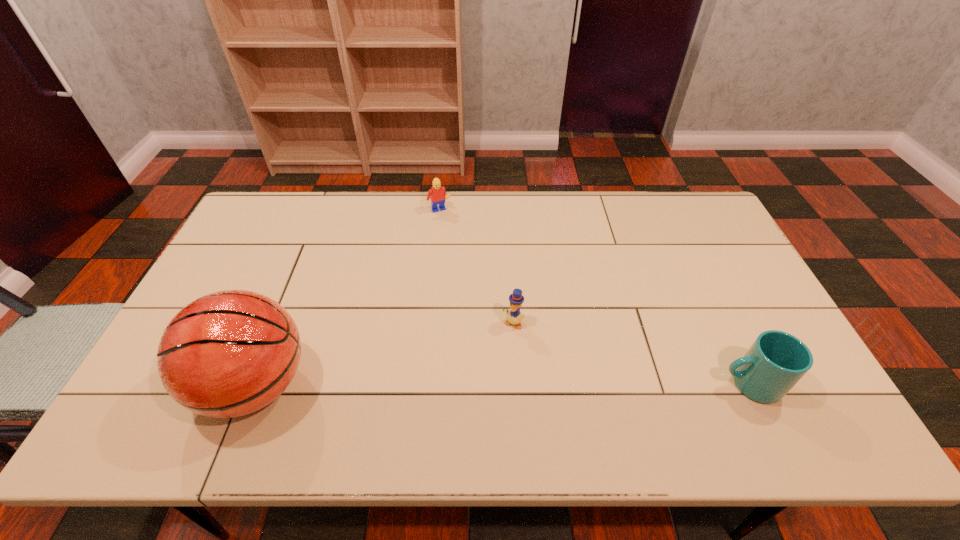
Identify the location of object that is at the right edge. (776, 361).

Where is `object at the near left corner`? The width and height of the screenshot is (960, 540). object at the near left corner is located at coordinates (230, 353).

You are a GUI agent. You are given a task and a screenshot of the screen. Output one action in this format:
    pyautogui.click(x=<x>, y=<y>)
    Task: Click on the object located at the near right corner
    This screenshot has width=960, height=540.
    Given the screenshot: What is the action you would take?
    pyautogui.click(x=776, y=361)

Image resolution: width=960 pixels, height=540 pixels. What are the coordinates of `vacant space at the far edge of the desktop` in the screenshot? It's located at (622, 207).

Locate an element on the screen. vacant space at the near edge of the desktop is located at coordinates (643, 384).

Identify the location of vacant point at the right edge. (711, 291).

Find the location of a particular element. unoccupied area between the rightmost object and the basketball is located at coordinates (503, 384).

The height and width of the screenshot is (540, 960). I want to click on free area in between the cup and the second object from right to left, so click(x=632, y=354).

Locate an element on the screen. unoccupied area between the cup and the leftmost object is located at coordinates (503, 384).

Find the location of a particular element. free space between the Lego and the cup is located at coordinates (594, 298).